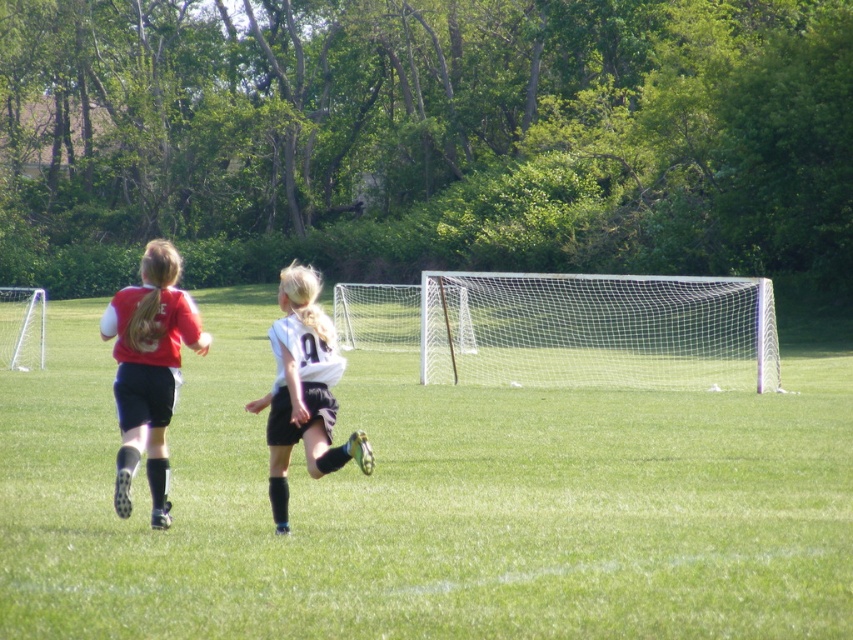
You are a soccer player standing at the center of the field. You notice a white mesh net at center located at point (596, 330). If you want to kick the ball towards the goalpost on the right side of the frame, should you aim to the left or right of the white mesh net at center?

You should aim to the right of the white mesh net at center because the goalpost is on the right side of the frame, so kicking towards the right of the net would direct the ball towards the goalpost.

You are a soccer player positioned at the point marked by coordinates (427, 502). What is the terrain like where you are standing?

The terrain at point (427, 502) is green grass field at center.

Looking at this image, you are standing on the soccer field and want to kick the ball to the point at coordinates point (560, 339). If your maximum kicking distance is 40 meters, will you be able to reach that point?

The point (560, 339) is 41.00 meters away from the viewer, which exceeds your maximum kicking distance of 40 meters. Therefore, you won not be able to reach that point.